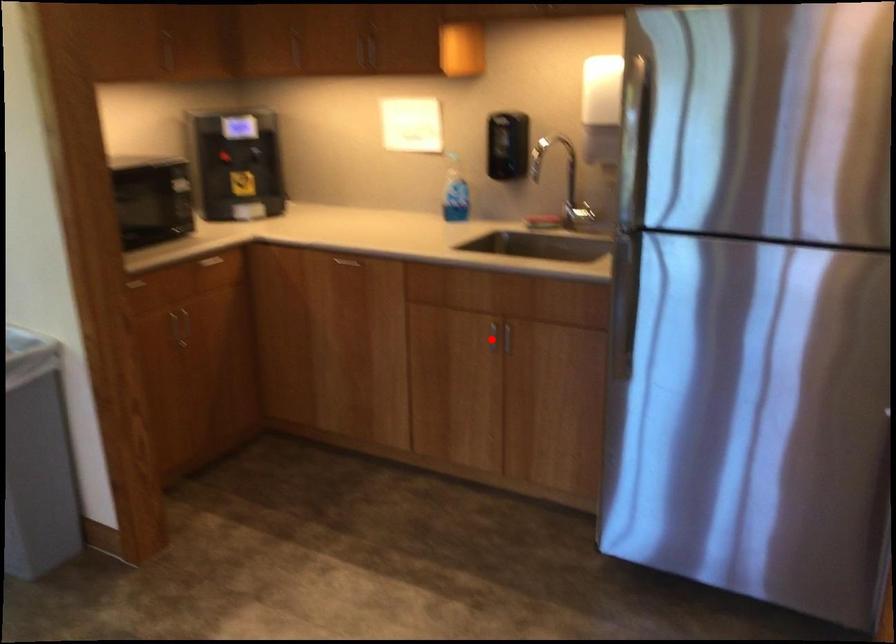
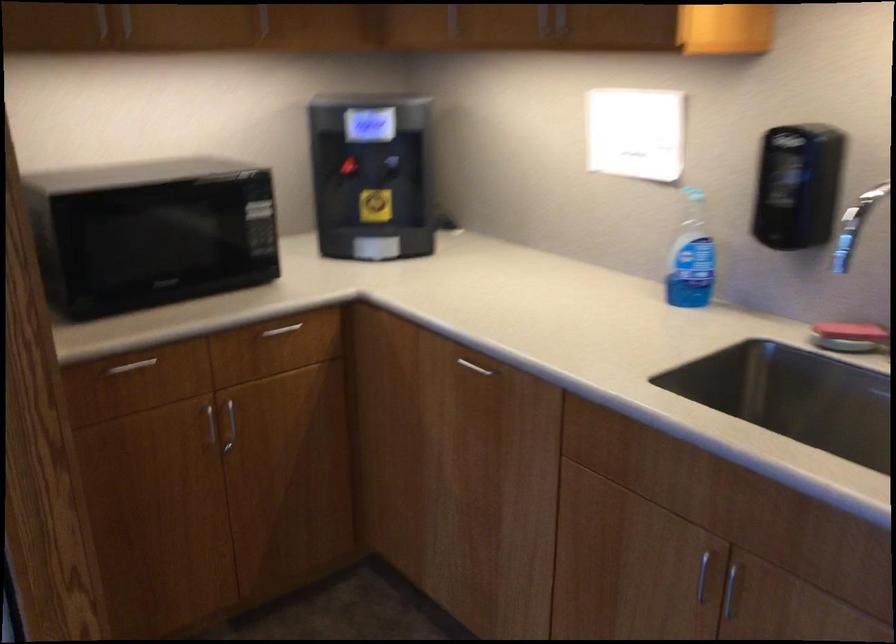
Locate, in the second image, the point that corresponds to the highlighted location in the first image.

(702, 574)